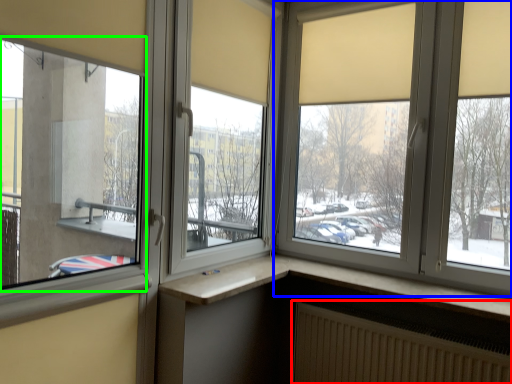
Question: Which object is positioned closest to radiator (highlighted by a red box)? Select from window (highlighted by a blue box) and window (highlighted by a green box).

Choices:
 (A) window
 (B) window

Answer: (A)